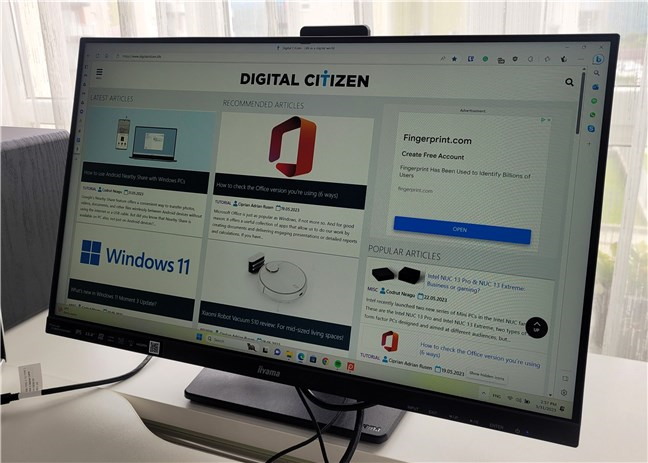
You are a GUI agent. You are given a task and a screenshot of the screen. Output one action in this format:
    pyautogui.click(x=<x>, y=<y>)
    Task: Click on the windows
    
    Given the screenshot: What is the action you would take?
    pyautogui.click(x=632, y=303), pyautogui.click(x=602, y=277), pyautogui.click(x=612, y=185), pyautogui.click(x=632, y=23)